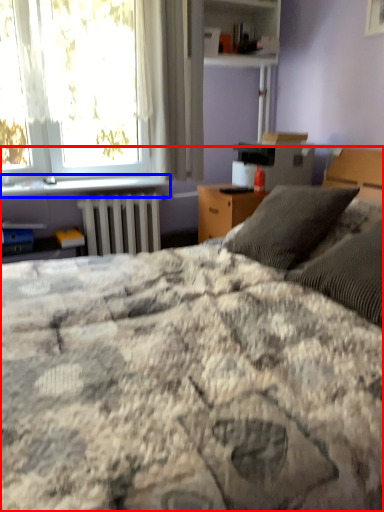
Question: Which object is closer to the camera taking this photo, bed (highlighted by a red box) or window sill (highlighted by a blue box)?

Choices:
 (A) bed
 (B) window sill

Answer: (A)